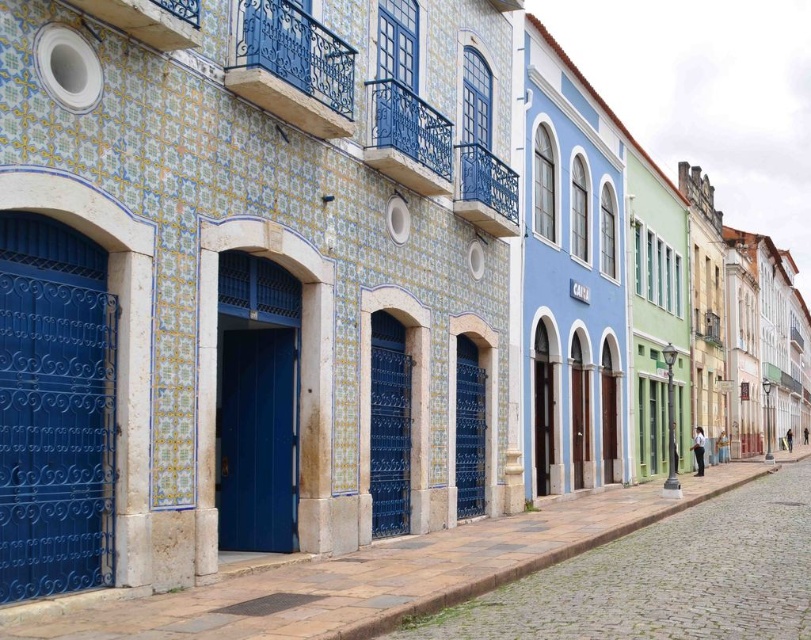
Who is positioned more to the left, matte blue door at center or matte blue gate at center?

matte blue door at center is more to the left.

Is matte blue door at center wider than matte blue gate at center?

Yes, matte blue door at center is wider than matte blue gate at center.

Identify the location of matte blue door at center. (256, 440).

Which is more to the left, matte blue gate at left or matte blue gate at center?

From the viewer's perspective, matte blue gate at left appears more on the left side.

Does matte blue gate at left have a greater width compared to matte blue gate at center?

Yes.

You are a GUI agent. You are given a task and a screenshot of the screen. Output one action in this format:
    pyautogui.click(x=<x>, y=<y>)
    Task: Click on the matte blue gate at left
    
    Given the screenshot: What is the action you would take?
    pyautogui.click(x=54, y=435)

The image size is (811, 640). Identify the location of matte blue gate at left. (54, 435).

Between point (36, 582) and point (260, 380), which one is positioned behind?

The point (260, 380) is more distant.

Between point (52, 579) and point (264, 540), which one is positioned behind?

The point (264, 540) is behind.

The image size is (811, 640). Find the location of `matte blue gate at left`. matte blue gate at left is located at coordinates (54, 435).